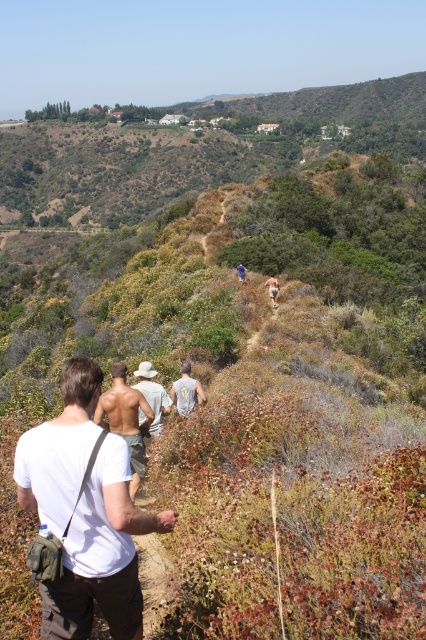
What do you see at coordinates (101, 554) in the screenshot? I see `white cotton shirt at center` at bounding box center [101, 554].

Who is higher up, white cotton shirt at center or blue fabric shirt at center?

blue fabric shirt at center is higher up.

Is point (124, 500) behind point (239, 275)?

No, it is in front of (239, 275).

What are the coordinates of `white cotton shirt at center` in the screenshot? It's located at (101, 554).

Can you confirm if white cotton shirt at center is positioned above tan woven hat at center?

Actually, white cotton shirt at center is below tan woven hat at center.

Can you confirm if white cotton shirt at center is bigger than tan woven hat at center?

Yes, white cotton shirt at center is bigger than tan woven hat at center.

Describe the element at coordinates (101, 554) in the screenshot. The width and height of the screenshot is (426, 640). I see `white cotton shirt at center` at that location.

Find the location of a particular element. Image resolution: width=426 pixels, height=640 pixels. white cotton shirt at center is located at coordinates (101, 554).

Is point (123, 397) closer to viewer compared to point (176, 387)?

Yes, it is.

Between shiny metallic shorts at center and light gray shirt at center, which one has less height?

light gray shirt at center

Is point (143, 461) positioned before point (192, 408)?

Yes, point (143, 461) is closer to viewer.

You are a GUI agent. You are given a task and a screenshot of the screen. Output one action in this format:
    pyautogui.click(x=<x>, y=<y>)
    Task: Click on the shiny metallic shorts at center
    
    Given the screenshot: What is the action you would take?
    pyautogui.click(x=124, y=419)